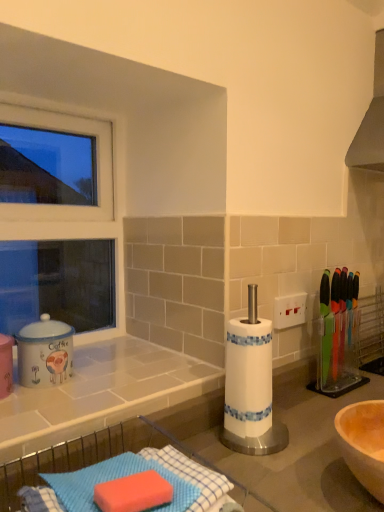
Where is `vacant area that lies to the right of matte ceramic coffee canister at left`? This screenshot has height=512, width=384. vacant area that lies to the right of matte ceramic coffee canister at left is located at coordinates (121, 385).